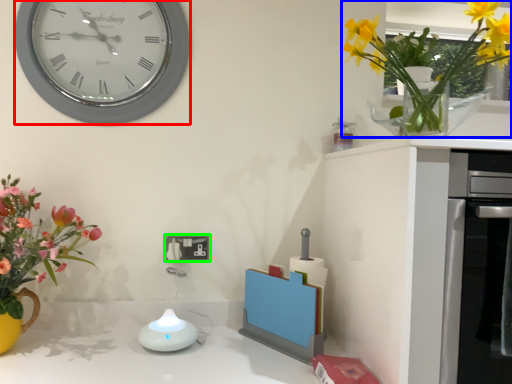
Question: Which object is the farthest from wall clock (highlighted by a red box)? Choose among these: floral arrangement (highlighted by a blue box) or electric outlet (highlighted by a green box).

Choices:
 (A) floral arrangement
 (B) electric outlet

Answer: (A)